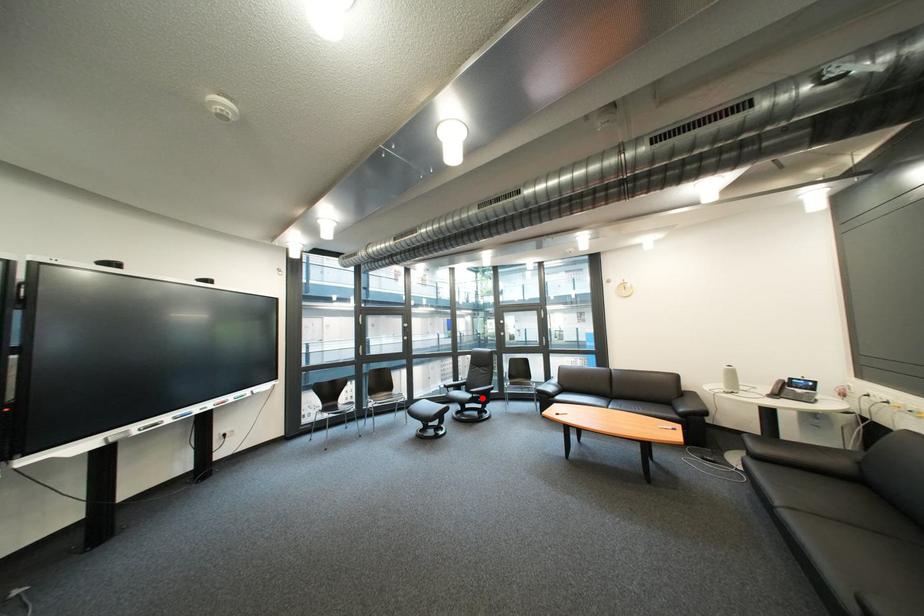
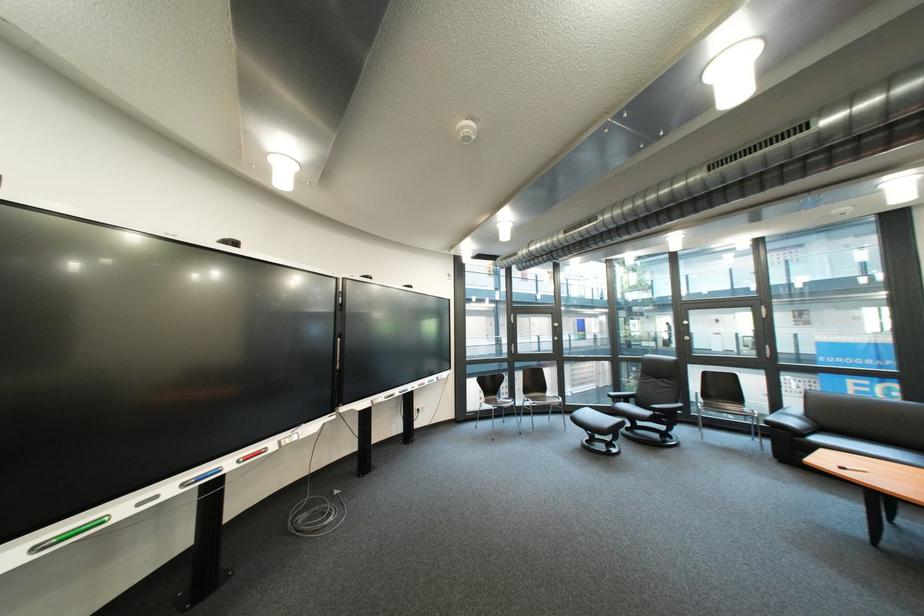
Find the pixel in the second image that matches the highlighted location in the first image.

(661, 415)